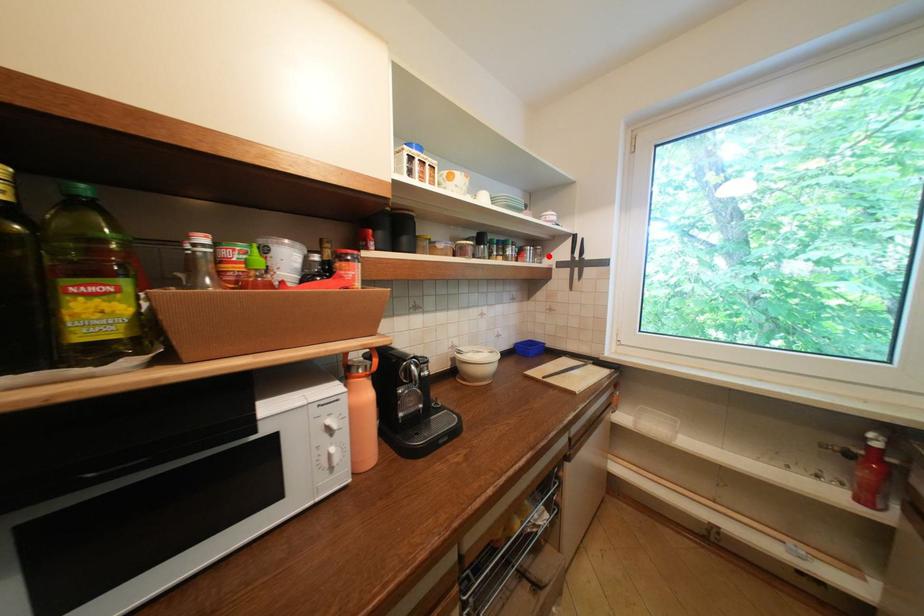
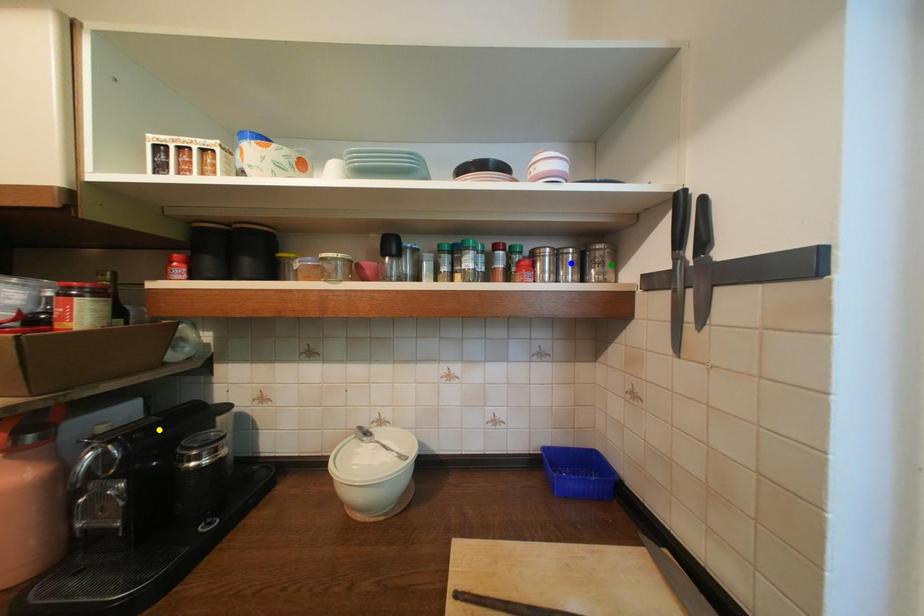
Question: I am providing you with two images of the same scene from different viewpoints. A red point is marked on the first image. You are given multiple points on the second image. Can you choose the point in image 2 that corresponds to the point in image 1?

Choices:
 (A) yellow point
 (B) green point
 (C) blue point

Answer: (B)